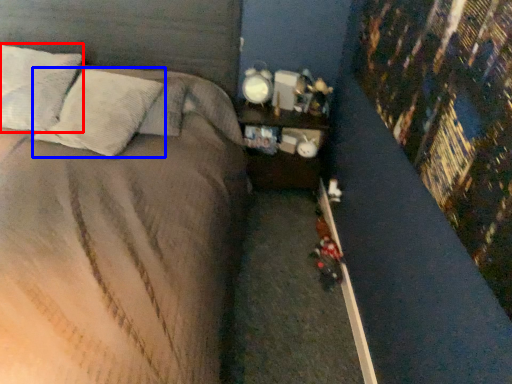
Question: Which object appears closest to the camera in this image, pillow (highlighted by a red box) or pillow (highlighted by a blue box)?

Choices:
 (A) pillow
 (B) pillow

Answer: (B)